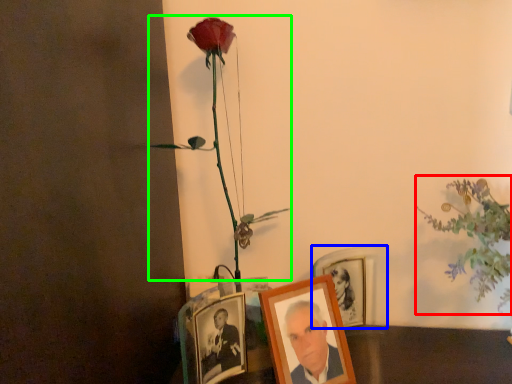
Question: Estimate the real-world distances between objects in this image. Which object is farther from floral arrangement (highlighted by a red box), picture frame (highlighted by a blue box) or floral arrangement (highlighted by a green box)?

Choices:
 (A) picture frame
 (B) floral arrangement

Answer: (B)